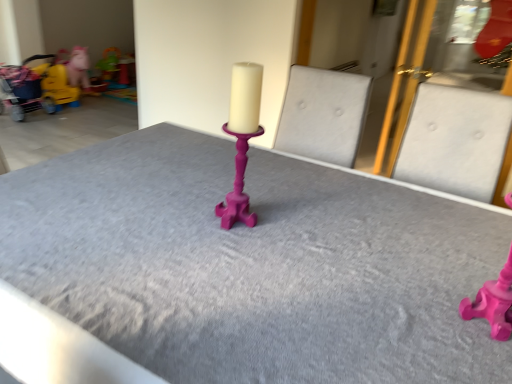
Question: From the image's perspective, would you say matte yellow toy at left, which is counted as the first toy, starting from the left, is shown under yellow fabric baby carriage at left?

Choices:
 (A) yes
 (B) no

Answer: (B)

Question: From a real-world perspective, is matte yellow toy at left, which appears as the 2th toy when viewed from the front, physically above yellow fabric baby carriage at left?

Choices:
 (A) no
 (B) yes

Answer: (A)

Question: From a real-world perspective, is matte yellow toy at left, which is counted as the first toy, starting from the left, physically below yellow fabric baby carriage at left?

Choices:
 (A) no
 (B) yes

Answer: (B)

Question: Does matte yellow toy at left, acting as the second toy starting from the top, contain yellow fabric baby carriage at left?

Choices:
 (A) yes
 (B) no

Answer: (B)

Question: Is matte yellow toy at left, which appears as the 2th toy when viewed from the front, oriented away from yellow fabric baby carriage at left?

Choices:
 (A) yes
 (B) no

Answer: (B)

Question: From the image's perspective, is matte yellow toy at left, which is the 3th toy from right to left, above yellow fabric baby carriage at left?

Choices:
 (A) yes
 (B) no

Answer: (A)

Question: Is yellow fabric baby carriage at left touching matte yellow toy at left, acting as the second toy starting from the top?

Choices:
 (A) no
 (B) yes

Answer: (A)

Question: Can you confirm if yellow fabric baby carriage at left is taller than matte yellow toy at left, which is the 3th toy from right to left?

Choices:
 (A) no
 (B) yes

Answer: (B)

Question: Is yellow fabric baby carriage at left positioned with its back to matte yellow toy at left, the second toy ordered from the bottom?

Choices:
 (A) yes
 (B) no

Answer: (B)

Question: From the image's perspective, is yellow fabric baby carriage at left located above matte yellow toy at left, which is counted as the first toy, starting from the left?

Choices:
 (A) no
 (B) yes

Answer: (A)

Question: Are yellow fabric baby carriage at left and matte yellow toy at left, which appears as the 2th toy when viewed from the front, located far from each other?

Choices:
 (A) no
 (B) yes

Answer: (A)

Question: Is yellow fabric baby carriage at left located outside matte yellow toy at left, the second toy ordered from the bottom?

Choices:
 (A) yes
 (B) no

Answer: (A)

Question: Are matte pink candlestick at center and matte yellow toy at left, the second toy ordered from the bottom, located far from each other?

Choices:
 (A) yes
 (B) no

Answer: (A)